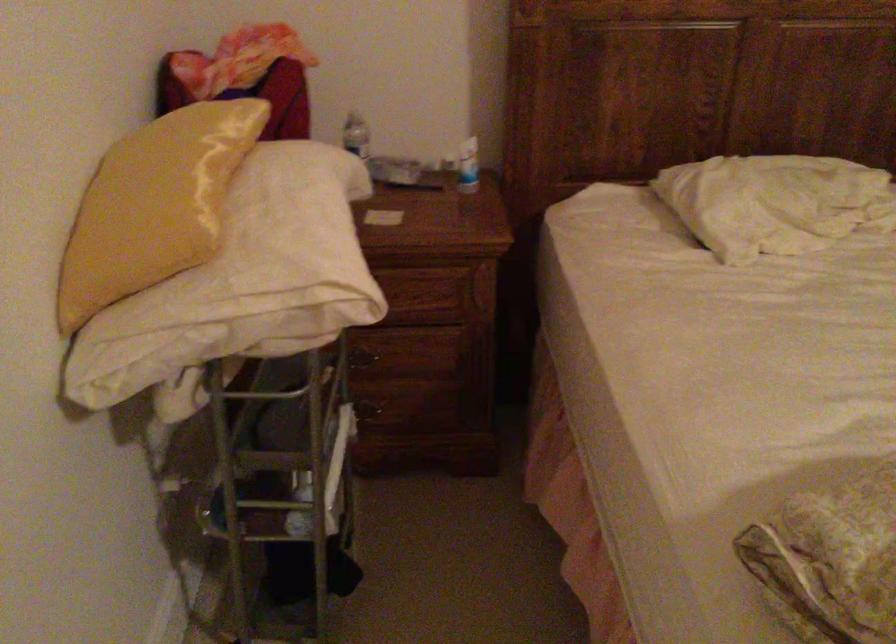
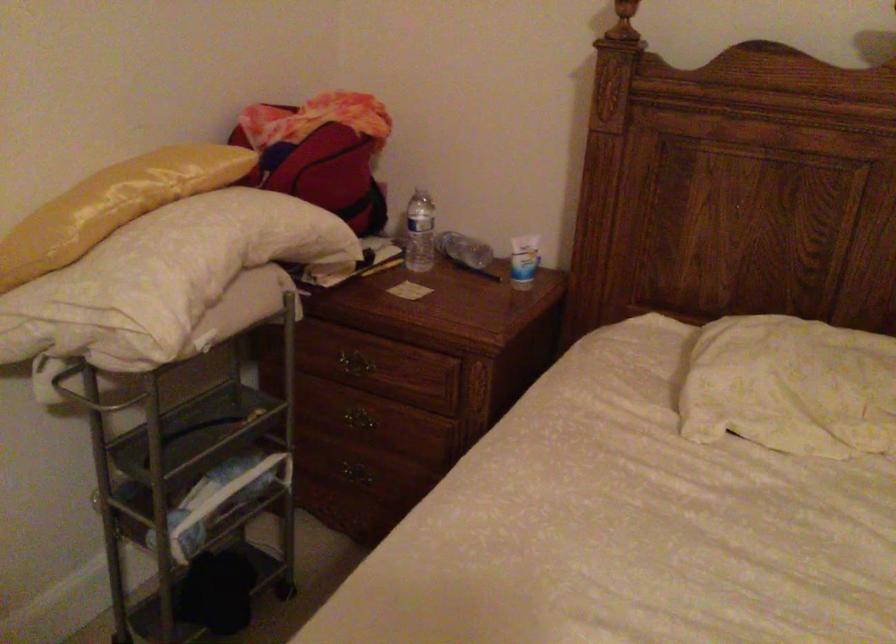
Where in the second image is the point corresponding to pixel 358 364 from the first image?

(357, 426)